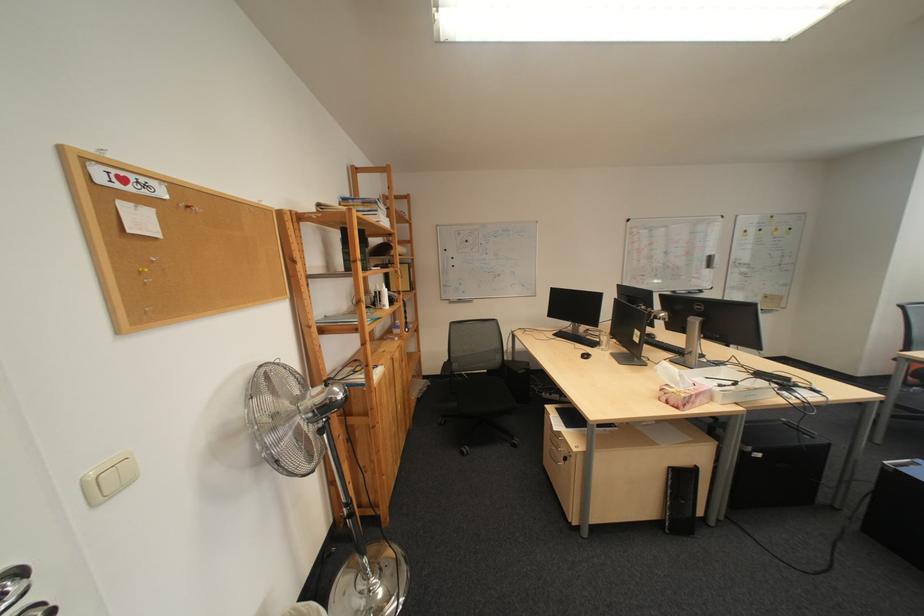
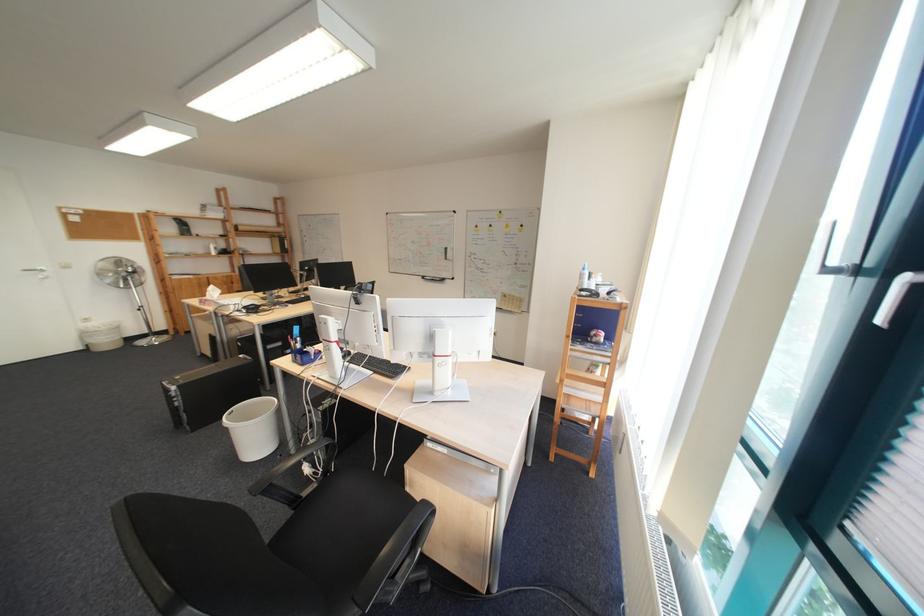
Question: I am providing you with two images of the same scene from different viewpoints. Please identify which objects are invisible in image2.

Choices:
 (A) telephone receiver
 (B) black chair sitting surface
 (C) black computer keyboard
 (D) silver door handle

Answer: (C)